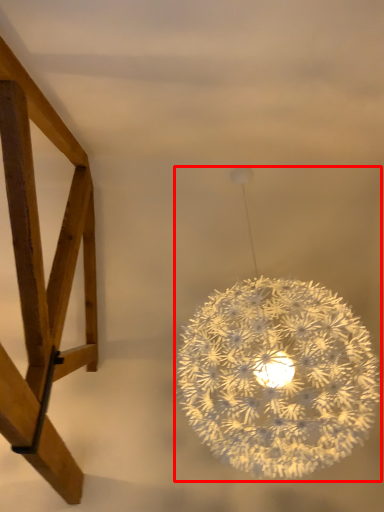
Question: From the image's perspective, what is the correct spatial positioning of lamp (annotated by the red box) in reference to furniture?

Choices:
 (A) below
 (B) above

Answer: (A)